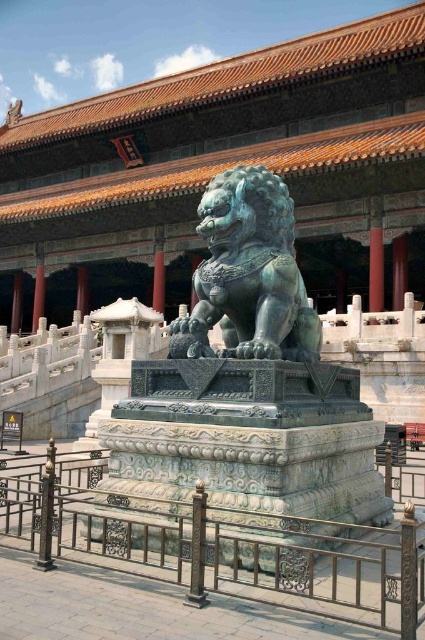
Who is more forward, (266, 593) or (274, 317)?

Positioned in front is point (266, 593).

Locate an element on the screen. The height and width of the screenshot is (640, 425). metallic gold railing at lower center is located at coordinates (217, 547).

Identify the location of metallic gold railing at lower center. (217, 547).